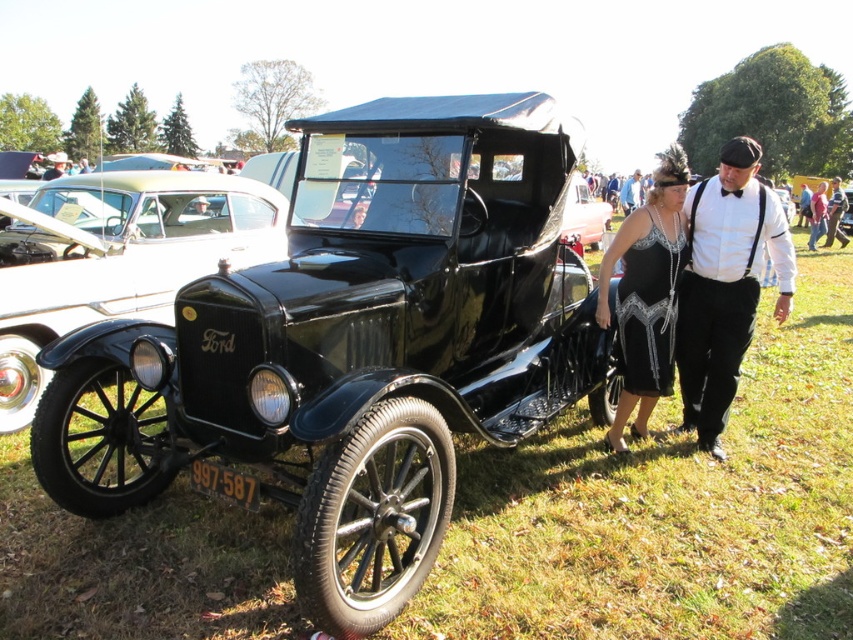
Question: Can you confirm if shiny black ford at center is positioned to the right of white cotton shirt at center?

Choices:
 (A) yes
 (B) no

Answer: (B)

Question: Is black satin dress at center behind black leather jacket at center?

Choices:
 (A) yes
 (B) no

Answer: (B)

Question: Which point is farther from the camera taking this photo?

Choices:
 (A) (697, 186)
 (B) (154, 253)

Answer: (B)

Question: Among these points, which one is farthest from the camera?

Choices:
 (A) (834, 182)
 (B) (200, 234)

Answer: (A)

Question: Which object is the closest to the white cotton shirt at center?

Choices:
 (A) shiny black ford at center
 (B) black satin dress at center
 (C) black leather jacket at center

Answer: (B)

Question: Does white cotton shirt at center appear on the left side of black leather jacket at center?

Choices:
 (A) no
 (B) yes

Answer: (B)